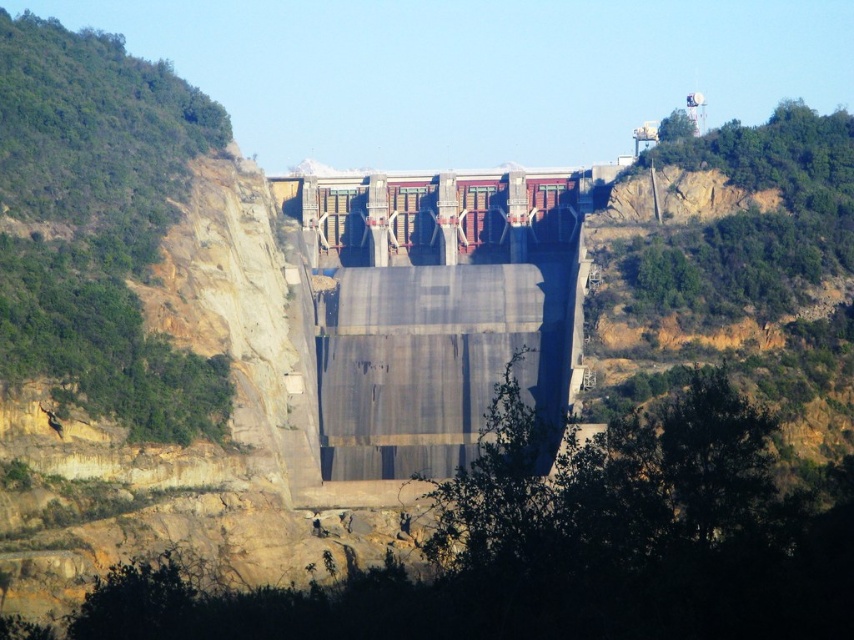
You are a drone operator tasked with capturing aerial footage of the gray concrete dam at center. Your drone has a maximum flight range of 500 feet. Can your drone safely reach the dam and return without exceeding its range limit?

The gray concrete dam at center is 550.82 feet away. Since the drone can only fly up to 500 feet, it cannot safely reach the dam without exceeding its maximum range.

You are a construction inspector evaluating the dam structure. You notice two sections of the dam labeled as gray concrete dam at center and smooth concrete dam at center. Which section has a greater width according to the specifications?

The gray concrete dam at center has a greater width than the smooth concrete dam at center based on the provided specifications.

You are a photographer standing in front of the two dams. You notice that the gray concrete dam at center and the smooth concrete dam at center are positioned in a way that one is closer to you than the other. Which dam is closer to you?

The gray concrete dam at center is closer to you because it is in front of the smooth concrete dam at center.